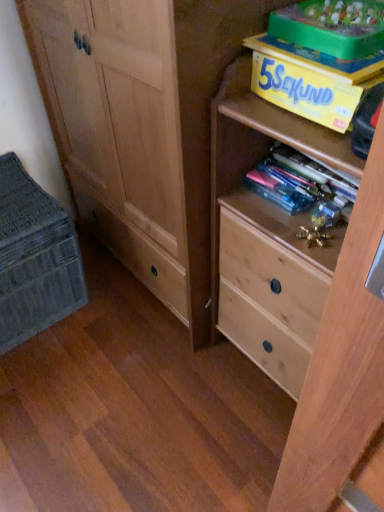
Question: Considering the relative positions of translucent plastic books at center, placed as the 1th book when sorted from bottom to top, and yellow cardboard box at upper right, acting as the first book starting from the top, in the image provided, is translucent plastic books at center, placed as the 1th book when sorted from bottom to top, to the left of yellow cardboard box at upper right, acting as the first book starting from the top, from the viewer's perspective?

Choices:
 (A) no
 (B) yes

Answer: (B)

Question: Is translucent plastic books at center, which is counted as the 2th book, starting from the top, oriented away from yellow cardboard box at upper right, which is the 2th book from bottom to top?

Choices:
 (A) yes
 (B) no

Answer: (B)

Question: Considering the relative sizes of translucent plastic books at center, which is counted as the 2th book, starting from the top, and yellow cardboard box at upper right, which is the 2th book from bottom to top, in the image provided, is translucent plastic books at center, which is counted as the 2th book, starting from the top, thinner than yellow cardboard box at upper right, which is the 2th book from bottom to top,?

Choices:
 (A) yes
 (B) no

Answer: (A)

Question: Is translucent plastic books at center, which is counted as the 2th book, starting from the top, surrounding yellow cardboard box at upper right, acting as the first book starting from the top?

Choices:
 (A) no
 (B) yes

Answer: (A)

Question: Can you confirm if translucent plastic books at center, which is counted as the 2th book, starting from the top, is smaller than yellow cardboard box at upper right, which is the 2th book from bottom to top?

Choices:
 (A) no
 (B) yes

Answer: (B)

Question: From a real-world perspective, is translucent plastic books at center, placed as the 1th book when sorted from bottom to top, located higher than yellow cardboard box at upper right, acting as the first book starting from the top?

Choices:
 (A) no
 (B) yes

Answer: (A)

Question: Is yellow cardboard box at upper right, which is the 2th book from bottom to top, next to woven fabric basket at lower left?

Choices:
 (A) no
 (B) yes

Answer: (A)

Question: Can woven fabric basket at lower left be found inside yellow cardboard box at upper right, acting as the first book starting from the top?

Choices:
 (A) yes
 (B) no

Answer: (B)

Question: From the image's perspective, is yellow cardboard box at upper right, acting as the first book starting from the top, over woven fabric basket at lower left?

Choices:
 (A) no
 (B) yes

Answer: (B)

Question: Is yellow cardboard box at upper right, which is the 2th book from bottom to top, not near woven fabric basket at lower left?

Choices:
 (A) yes
 (B) no

Answer: (B)

Question: Is yellow cardboard box at upper right, which is the 2th book from bottom to top, positioned before woven fabric basket at lower left?

Choices:
 (A) no
 (B) yes

Answer: (B)

Question: Is yellow cardboard box at upper right, which is the 2th book from bottom to top, oriented away from woven fabric basket at lower left?

Choices:
 (A) yes
 (B) no

Answer: (B)

Question: Can you confirm if translucent plastic books at center, placed as the 1th book when sorted from bottom to top, is bigger than green plastic storage box at upper right?

Choices:
 (A) yes
 (B) no

Answer: (B)